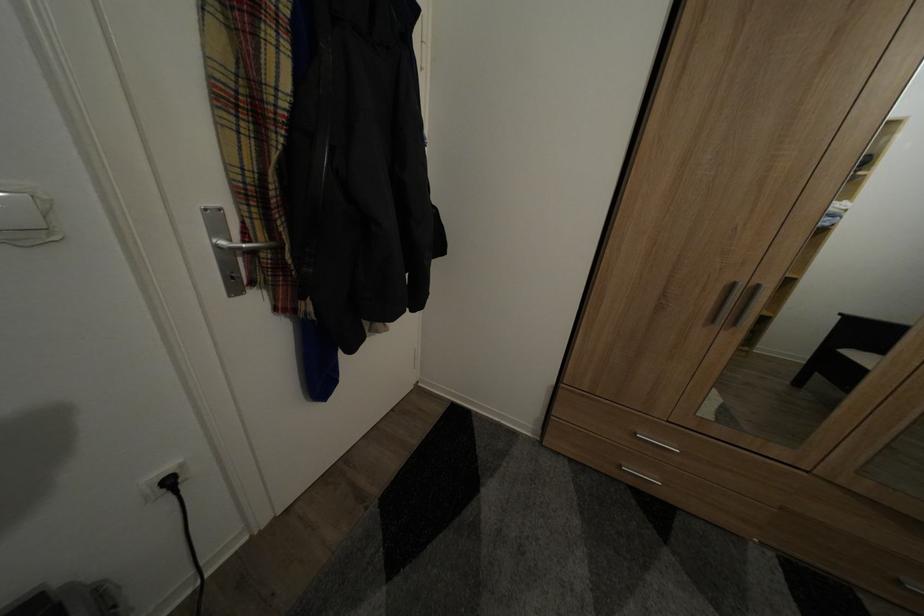
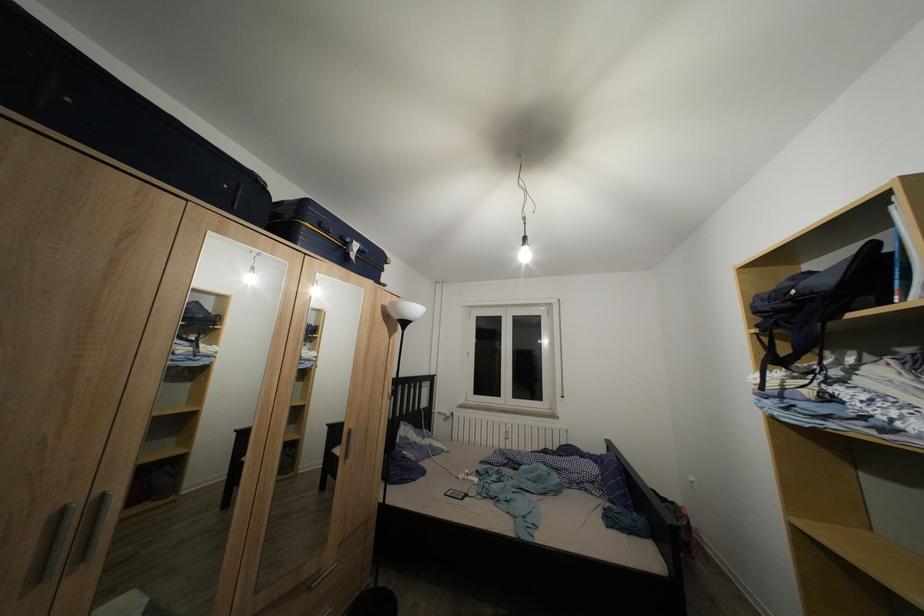
The point at [743,291] is marked in the first image. Where is the corresponding point in the second image?

(71, 515)